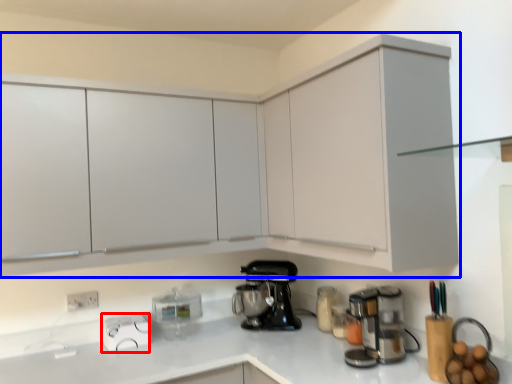
Question: Which point is further to the camera, appliance (highlighted by a red box) or cabinetry (highlighted by a blue box)?

Choices:
 (A) appliance
 (B) cabinetry

Answer: (A)